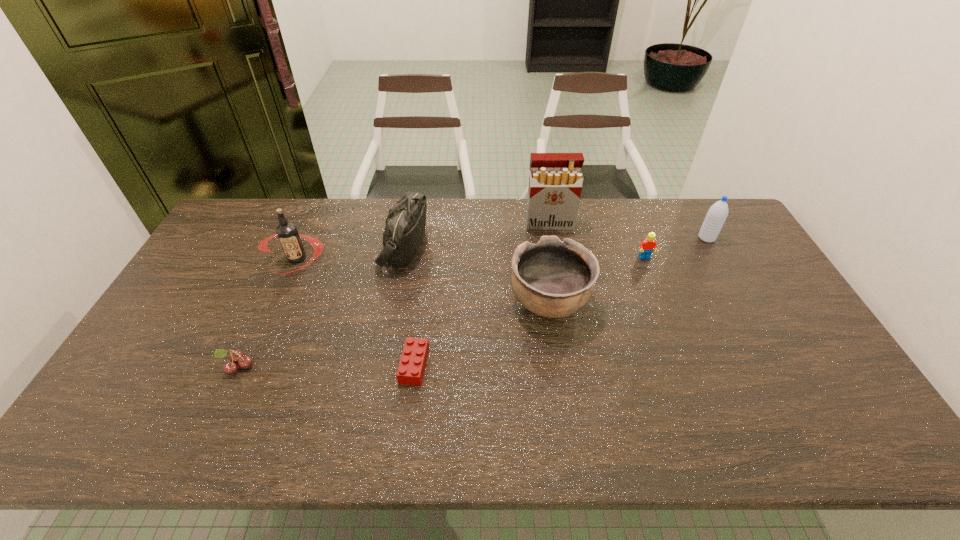
Locate an element on the screen. The image size is (960, 540). vacant space that's between the root beer and the tallest object is located at coordinates (423, 242).

You are a GUI agent. You are given a task and a screenshot of the screen. Output one action in this format:
    pyautogui.click(x=<x>, y=<y>)
    Task: Click on the free point between the shoulder bag and the cigarette case
    The image size is (960, 540).
    Given the screenshot: What is the action you would take?
    pyautogui.click(x=476, y=236)

Where is `free space between the shoulder bag and the root beer`? free space between the shoulder bag and the root beer is located at coordinates (350, 252).

Locate an element on the screen. empty space between the pottery and the rightmost object is located at coordinates (628, 270).

Where is `free space between the pottery and the left Lego`? The width and height of the screenshot is (960, 540). free space between the pottery and the left Lego is located at coordinates (482, 334).

This screenshot has height=540, width=960. Identify the location of empty space between the cigarette case and the shoulder bag. 476,236.

Identify which object is the fifth nearest to the farther Lego. Please provide its 2D coordinates. Your answer should be formatted as a tuple, i.e. [(x, y)], where the tuple contains the x and y coordinates of a point satisfying the conditions above.

[(411, 368)]

Image resolution: width=960 pixels, height=540 pixels. What are the coordinates of `object that is the fourth closest to the shoulder bag` in the screenshot? It's located at (555, 182).

Image resolution: width=960 pixels, height=540 pixels. I want to click on free location that satisfies the following two spatial constraints: 1. with the lid open on the rightmost object; 2. on the right side of the tallest object, so click(551, 238).

Find the location of a particular element. free space that satisfies the following two spatial constraints: 1. at the front padded panel of the shoulder bag; 2. on the leaves of the seventh tallest object is located at coordinates (382, 366).